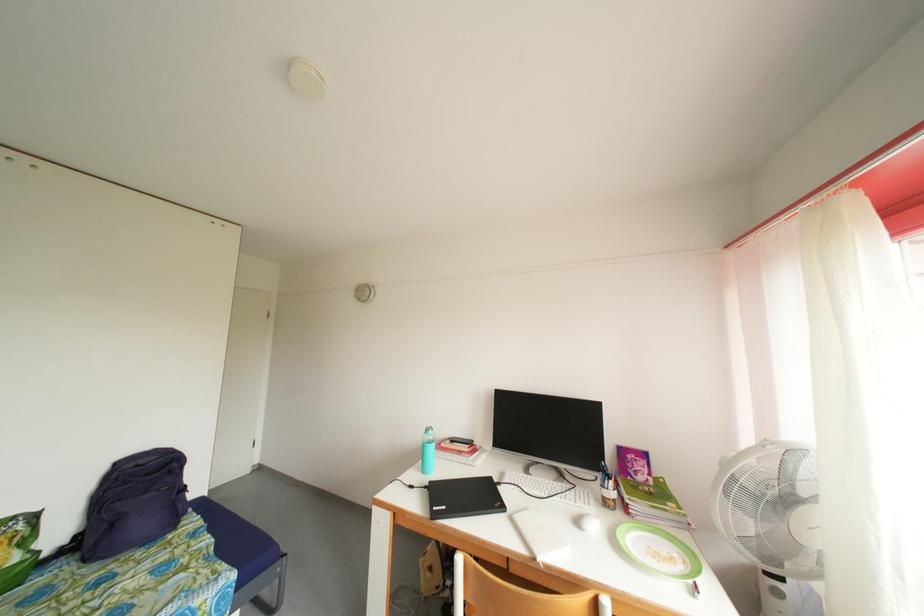
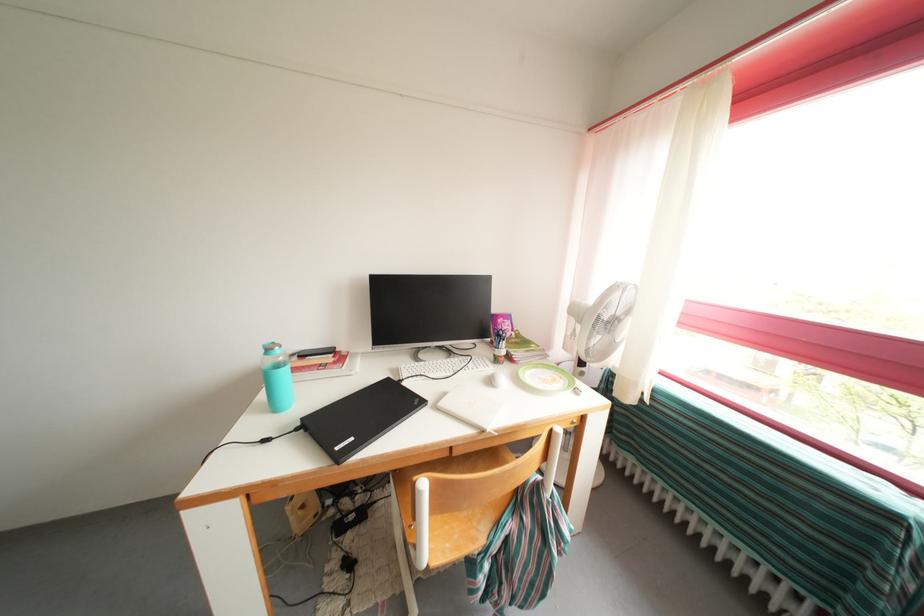
First-person continuous shooting, in which direction is the camera rotating?

The rotation direction of the camera is right-down.